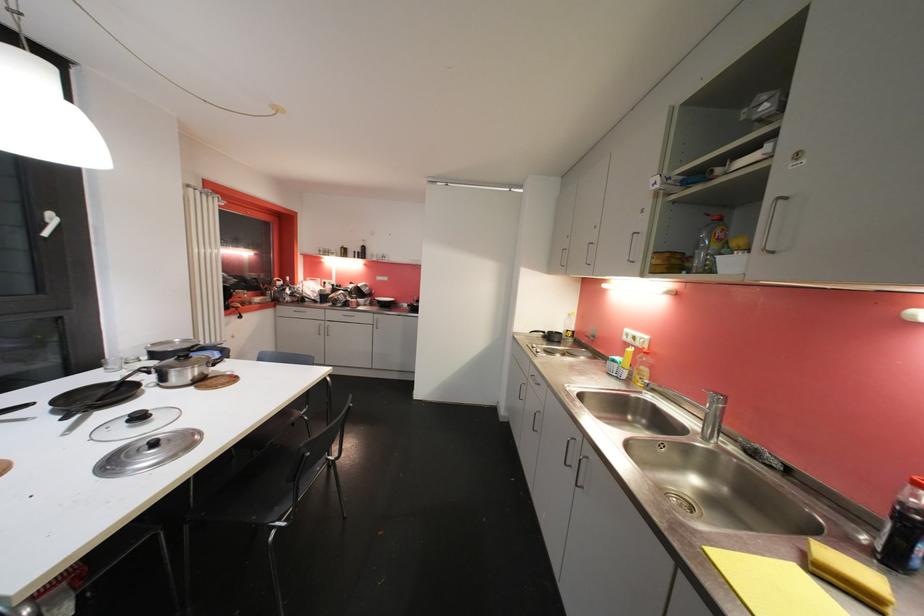
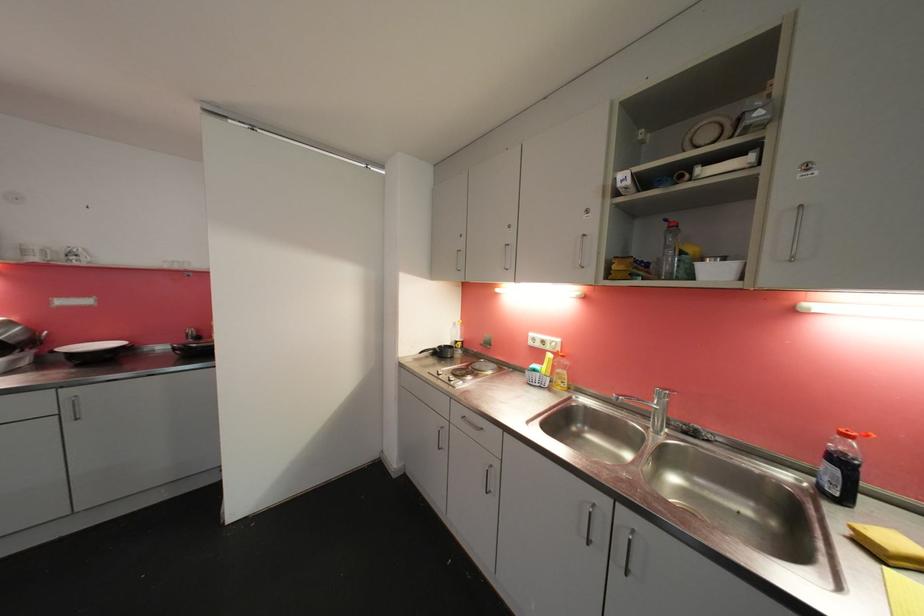
Locate, in the second image, the point that corresponds to pixel 618 363 in the first image.

(540, 373)